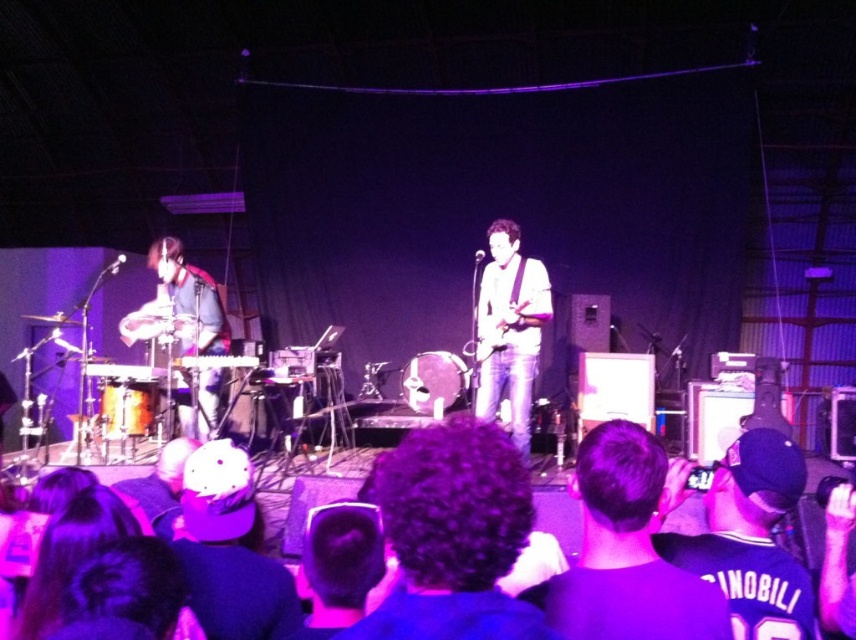
Question: Is matte black drum set at left wider than brushed metal keyboard at left?

Choices:
 (A) yes
 (B) no

Answer: (A)

Question: Can you confirm if matte black drum set at left is positioned to the right of brushed metal drum at left?

Choices:
 (A) yes
 (B) no

Answer: (B)

Question: Is white matte guitar at center in front of matte black guitar at center?

Choices:
 (A) no
 (B) yes

Answer: (A)

Question: Which of the following is the closest to the observer?

Choices:
 (A) brushed metal drum at left
 (B) brushed metal keyboard at left

Answer: (A)

Question: Among these objects, which one is farthest from the camera?

Choices:
 (A) white matte guitar at center
 (B) brushed metal keyboard at left
 (C) matte black drum set at left
 (D) brushed metal drum at left

Answer: (B)

Question: Which object is positioned farthest from the white matte guitar at center?

Choices:
 (A) brushed metal drum at left
 (B) brushed metal keyboard at left
 (C) matte black guitar at center
 (D) matte black drum set at left

Answer: (B)